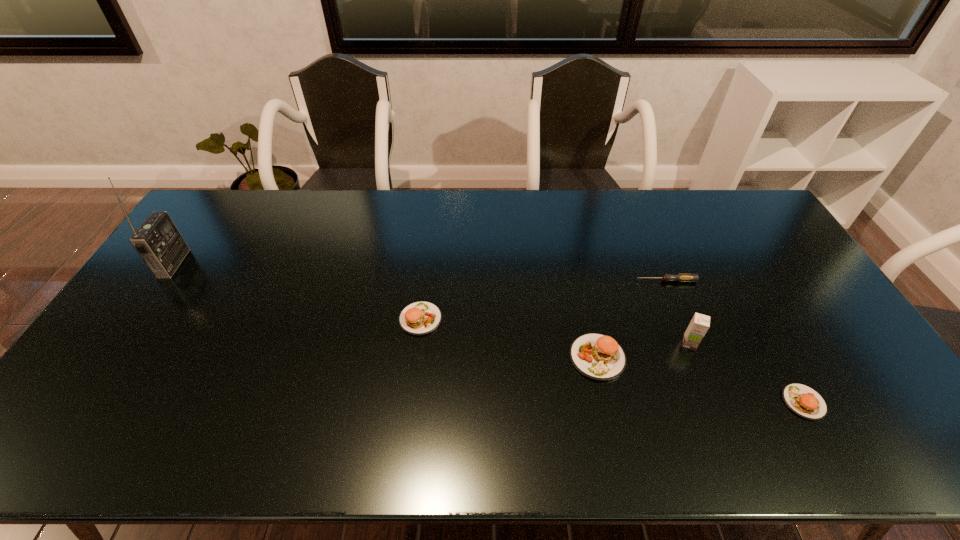
Where is `vacant space at the near edge`? The image size is (960, 540). vacant space at the near edge is located at coordinates (730, 394).

Locate an element on the screen. The image size is (960, 540). vacant space at the left edge of the desktop is located at coordinates (132, 340).

Where is `vacant region at the right edge of the desktop`? The width and height of the screenshot is (960, 540). vacant region at the right edge of the desktop is located at coordinates (805, 287).

Where is `vacant area at the far right corner`? Image resolution: width=960 pixels, height=540 pixels. vacant area at the far right corner is located at coordinates pos(760,215).

Locate an element on the screen. free space between the fourth tallest object and the shortest object is located at coordinates (543, 300).

Where is `vacant space that is in between the tallest patty and the leftmost patty`? This screenshot has width=960, height=540. vacant space that is in between the tallest patty and the leftmost patty is located at coordinates (509, 338).

The image size is (960, 540). I want to click on vacant space that's between the rightmost patty and the fourth shortest object, so click(701, 380).

In order to click on free spot between the second patty from right to left and the chocolate milk in this screenshot , I will do `click(643, 350)`.

The image size is (960, 540). I want to click on empty location between the third tallest object and the shortest object, so click(632, 319).

Where is `vacant point located between the tallest patty and the tallest object`? The height and width of the screenshot is (540, 960). vacant point located between the tallest patty and the tallest object is located at coordinates (386, 310).